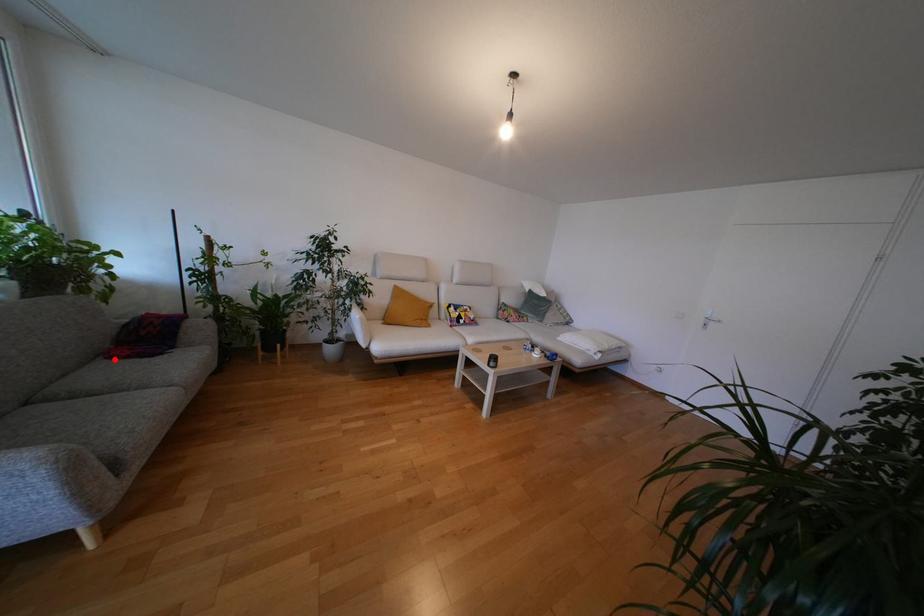
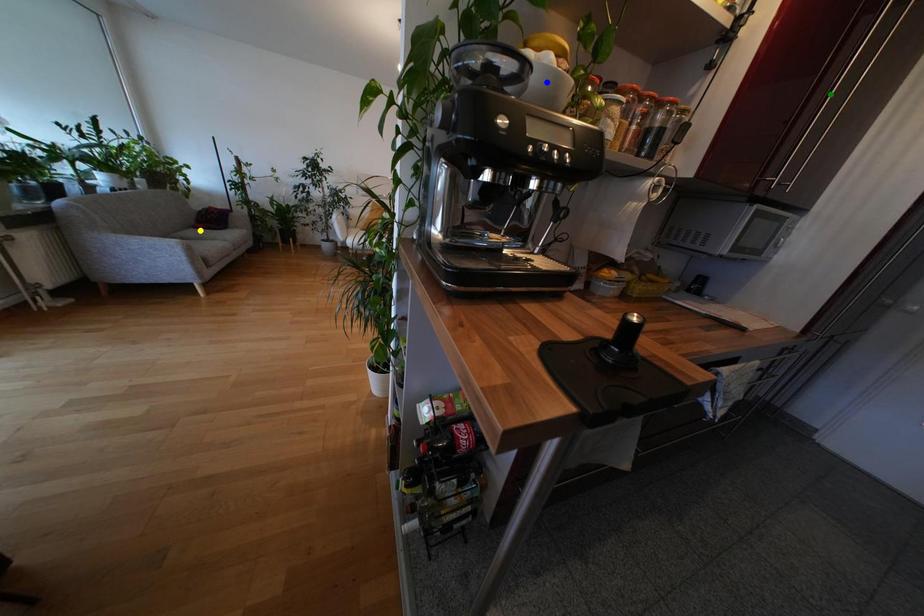
Question: I am providing you with two images of the same scene from different viewpoints. A red point is marked on the first image. You are given multiple points on the second image. Which spot in image 2 lines up with the point in image 1?

Choices:
 (A) blue point
 (B) green point
 (C) yellow point

Answer: (C)